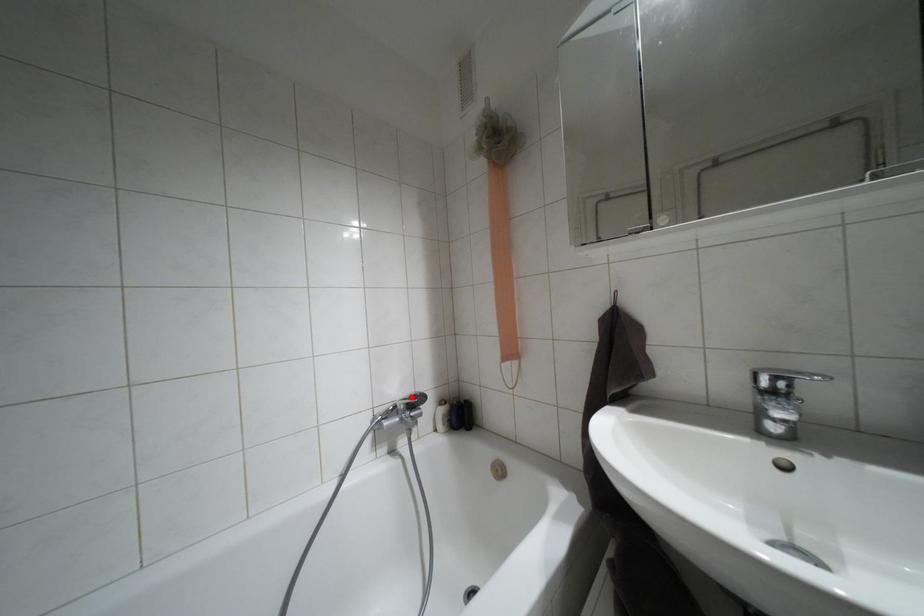
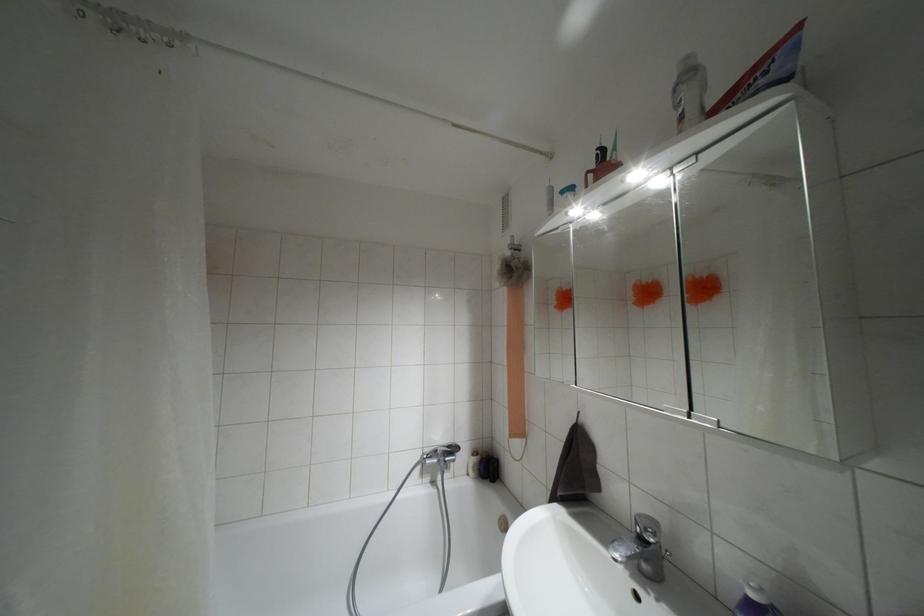
Question: I am providing you with two images of the same scene from different viewpoints. A red point is shown in image1. For the corresponding object point in image2, is it positioned nearer or farther from the camera?

Choices:
 (A) Nearer
 (B) Farther

Answer: (B)